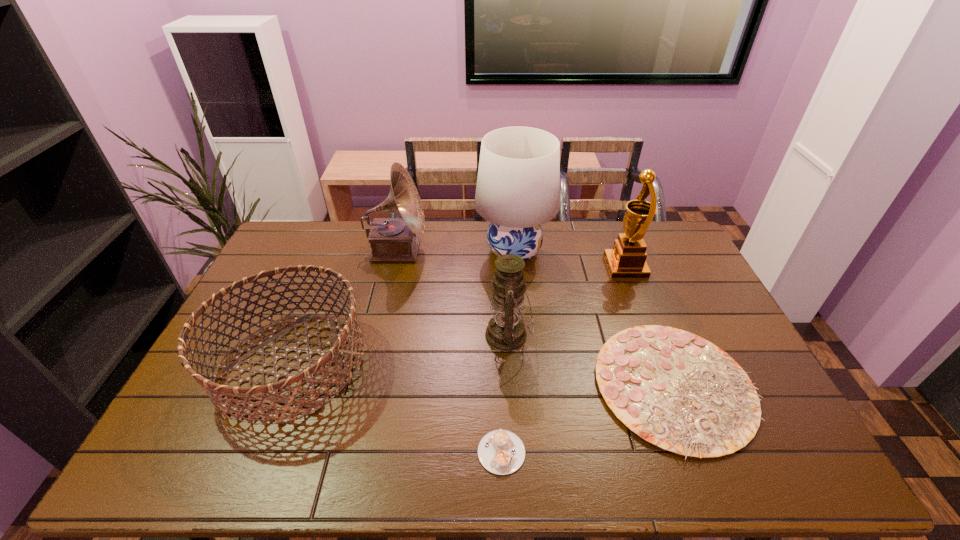
What are the coordinates of `free space located 0.120m on the front-facing side of the award` in the screenshot? It's located at (573, 267).

This screenshot has width=960, height=540. Find the location of `vacant region located 0.290m on the front-facing side of the award`. vacant region located 0.290m on the front-facing side of the award is located at coordinates (526, 267).

The width and height of the screenshot is (960, 540). Find the location of `free space located on the front-facing side of the award`. free space located on the front-facing side of the award is located at coordinates (512, 267).

Where is `free space located on the horn of the phonograph record`? This screenshot has width=960, height=540. free space located on the horn of the phonograph record is located at coordinates (534, 251).

Image resolution: width=960 pixels, height=540 pixels. I want to click on vacant space located on the front of the fourth tallest object, so click(x=515, y=439).

Locate an element on the screen. The height and width of the screenshot is (540, 960). vacant area situated 0.230m on the right of the third shortest object is located at coordinates (446, 364).

At what (x,y) coordinates should I click in order to perform the action: click on free space located 0.110m on the back of the second shortest object. Please return your answer as a coordinate pair (x, y). Image resolution: width=960 pixels, height=540 pixels. Looking at the image, I should click on (643, 302).

The width and height of the screenshot is (960, 540). What are the coordinates of `vacant area located 0.370m on the left of the cappuccino` in the screenshot? It's located at (323, 452).

Identify the location of lampshade at the far edge. (518, 185).

I want to click on award present at the far edge, so click(627, 260).